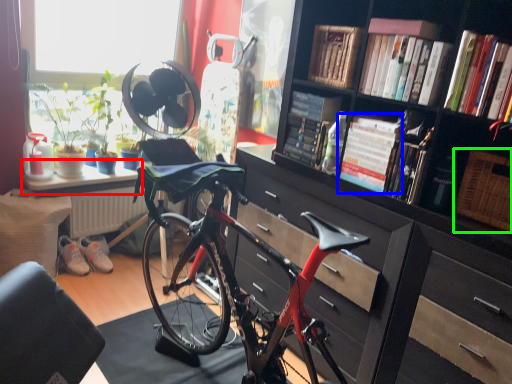
Question: Based on their relative distances, which object is farther from table (highlighted by a red box)? Choose from book (highlighted by a blue box) and picnic basket (highlighted by a green box).

Choices:
 (A) book
 (B) picnic basket

Answer: (B)